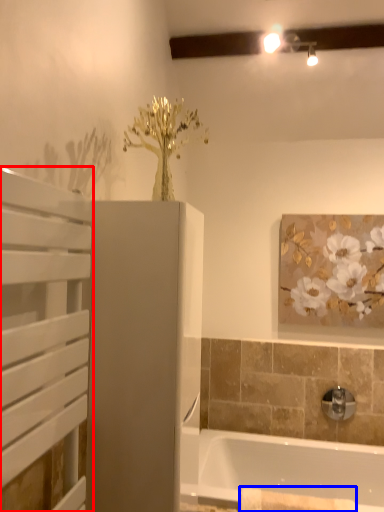
Question: Among these objects, which one is farthest to the camera, screen door (highlighted by a red box) or bath towel (highlighted by a blue box)?

Choices:
 (A) screen door
 (B) bath towel

Answer: (B)